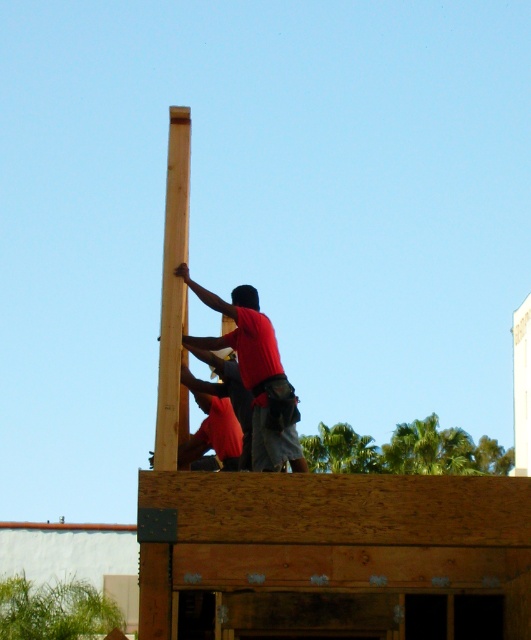
Question: Which object is farther from the camera taking this photo?

Choices:
 (A) red shirt at center
 (B) light brown wood at center

Answer: (A)

Question: Is light brown wood at center bigger than red shirt at center?

Choices:
 (A) yes
 (B) no

Answer: (A)

Question: Does light brown wood at center have a larger size compared to red shirt at center?

Choices:
 (A) yes
 (B) no

Answer: (A)

Question: Which point appears closest to the camera in this image?

Choices:
 (A) (185, 408)
 (B) (237, 288)

Answer: (B)

Question: In this image, where is light brown wood at center located relative to red shirt at center?

Choices:
 (A) above
 (B) below

Answer: (A)